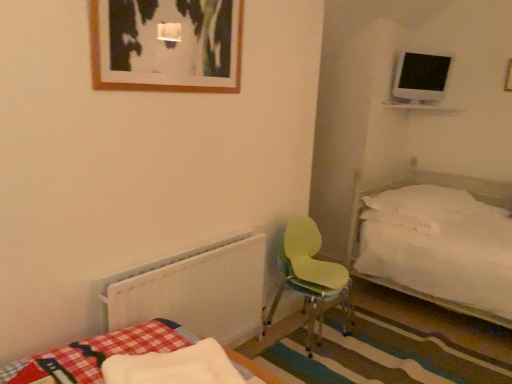
What are the coordinates of `free space in front of light green plastic chair at center` in the screenshot? It's located at (324, 368).